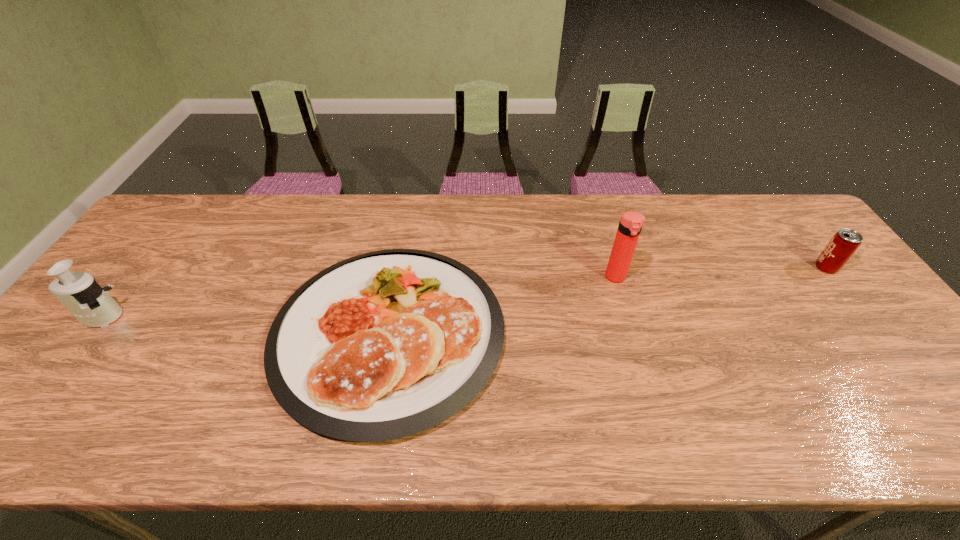
Where is `the tallest object`? the tallest object is located at coordinates (631, 223).

Identify the location of thermos bottle. (631, 223).

This screenshot has width=960, height=540. I want to click on the third shortest object, so click(x=85, y=299).

Find the location of `juicer`. juicer is located at coordinates [85, 299].

Where is `the rightmost object`? The height and width of the screenshot is (540, 960). the rightmost object is located at coordinates (845, 242).

Locate an element on the screen. This screenshot has width=960, height=540. beer can is located at coordinates (845, 242).

Identify the location of the second object from left to right. This screenshot has height=540, width=960. (383, 345).

In order to click on dish in this screenshot , I will do `click(383, 345)`.

Image resolution: width=960 pixels, height=540 pixels. What are the coordinates of `vacant space located on the left of the thermos bottle` in the screenshot? It's located at (525, 278).

Locate an element on the screen. The image size is (960, 540). vacant space located 0.310m on the front of the second tallest object is located at coordinates (1, 449).